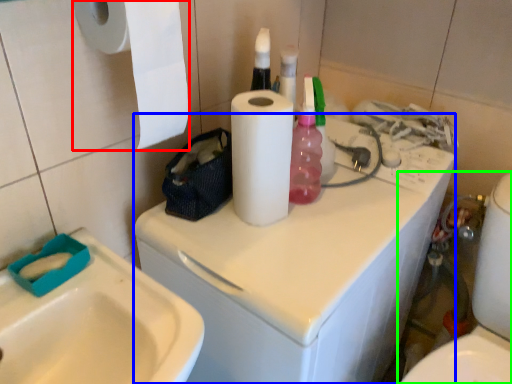
Question: Based on their relative distances, which object is farther from paper towel (highlighted by a red box)? Choose from washing machine (highlighted by a blue box) and toilet (highlighted by a green box).

Choices:
 (A) washing machine
 (B) toilet

Answer: (B)